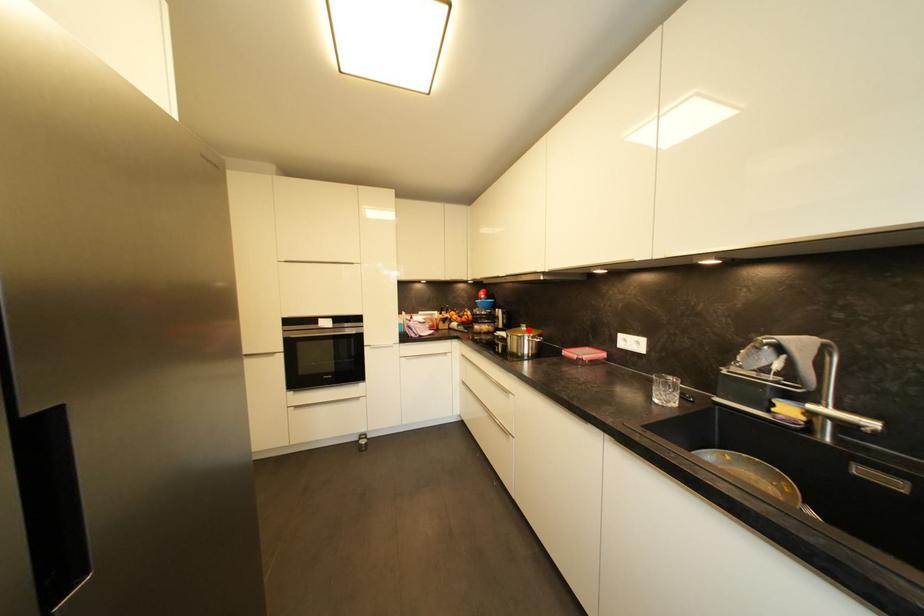
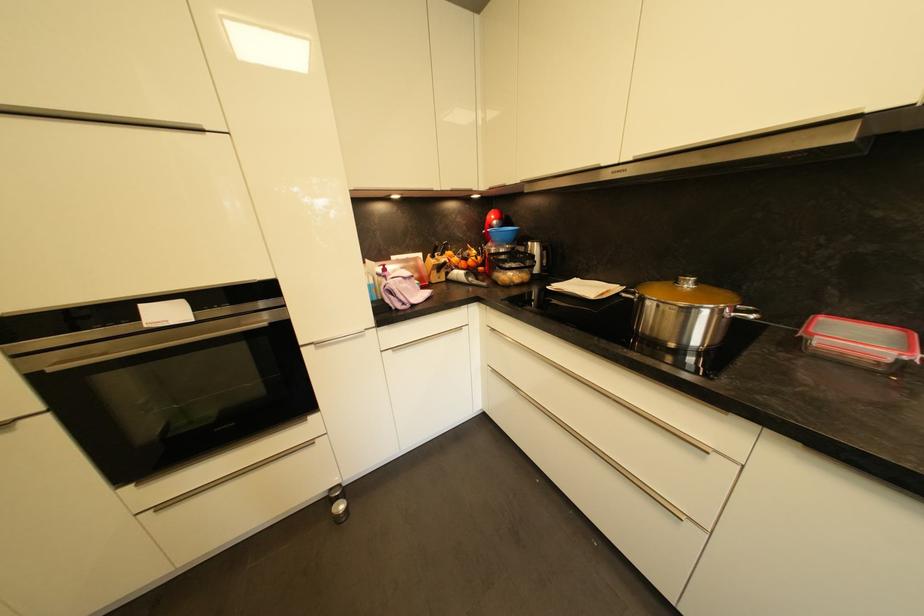
Question: I am providing you with two images of the same scene from different viewpoints. Given a red point in image1, look at the same physical point in image2. Is it:

Choices:
 (A) Closer to the viewpoint
 (B) Farther from the viewpoint

Answer: (B)